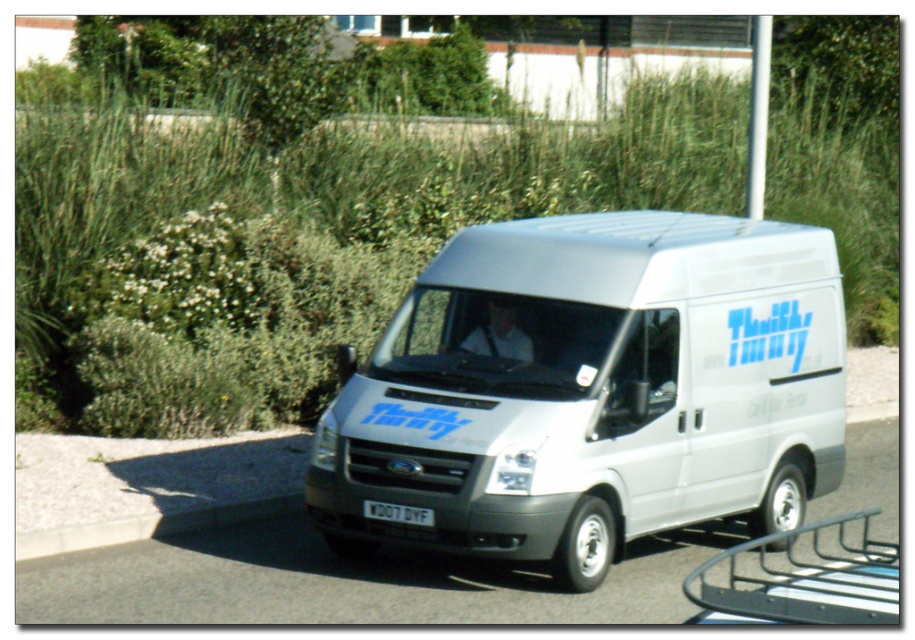
Which is more to the right, white matte van at center or gray concrete curb at lower left?

white matte van at center is more to the right.

Looking at this image, which of these two, white matte van at center or gray concrete curb at lower left, stands shorter?

Standing shorter between the two is gray concrete curb at lower left.

Is point (669, 305) positioned in front of point (154, 538)?

Yes, it is in front of point (154, 538).

The height and width of the screenshot is (640, 915). I want to click on white matte van at center, so click(590, 392).

Is black metal bike rack at lower right taller than gray concrete curb at lower left?

No.

Can you confirm if black metal bike rack at lower right is thinner than gray concrete curb at lower left?

Correct, black metal bike rack at lower right's width is less than gray concrete curb at lower left's.

Where is `black metal bike rack at lower right`? Image resolution: width=915 pixels, height=640 pixels. black metal bike rack at lower right is located at coordinates (803, 580).

Who is taller, white matte van at center or black metal bike rack at lower right?

white matte van at center

Between point (768, 442) and point (824, 595), which one is positioned behind?

The point (768, 442) is more distant.

Find the location of a particular element. Image resolution: width=915 pixels, height=640 pixels. white matte van at center is located at coordinates (590, 392).